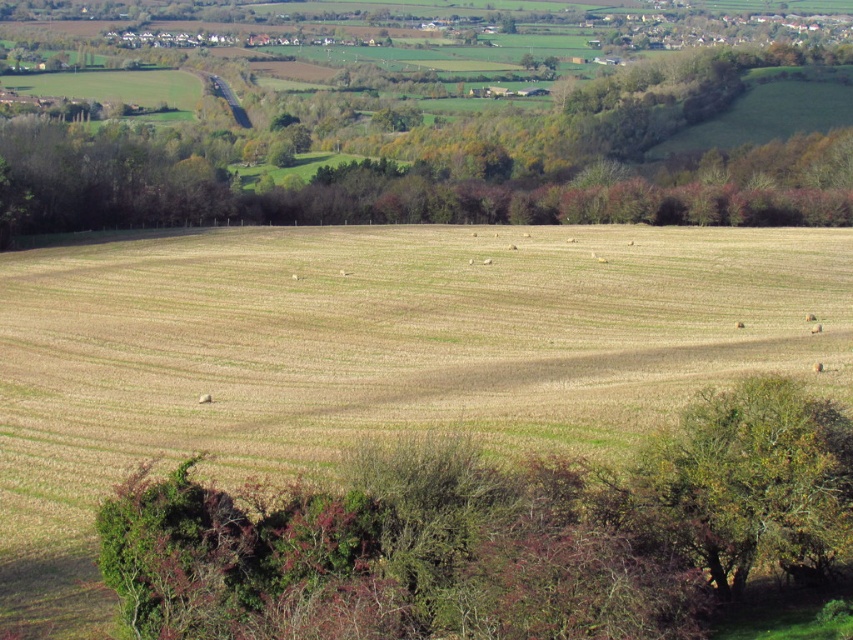
Question: Does brown grassland at center have a larger size compared to green leafy tree at lower right?

Choices:
 (A) yes
 (B) no

Answer: (A)

Question: Is brown grassland at center below green leafy tree at lower right?

Choices:
 (A) no
 (B) yes

Answer: (A)

Question: Among these objects, which one is farthest from the camera?

Choices:
 (A) green leafy tree at lower right
 (B) brown grassland at center

Answer: (B)

Question: Does brown grassland at center have a larger size compared to green leafy tree at lower right?

Choices:
 (A) yes
 (B) no

Answer: (A)